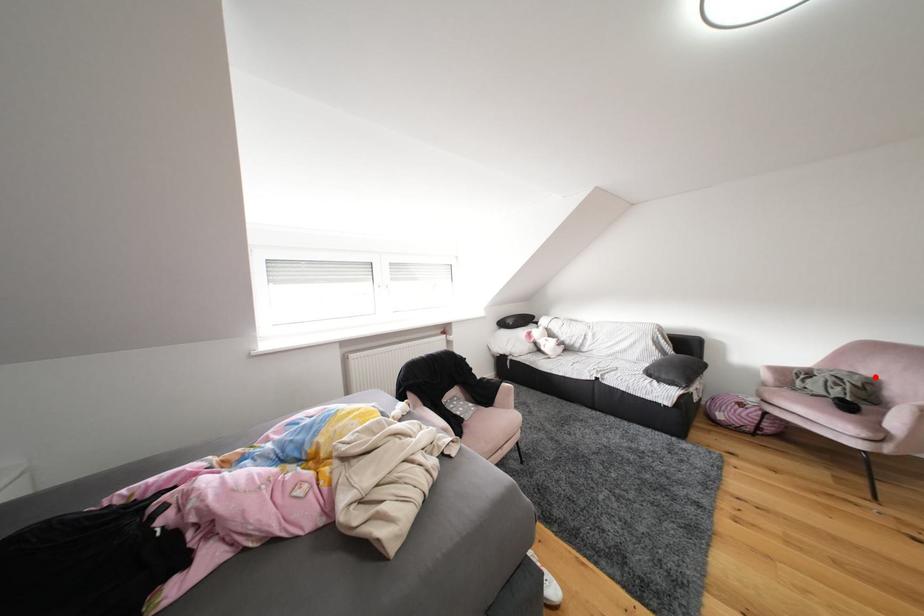
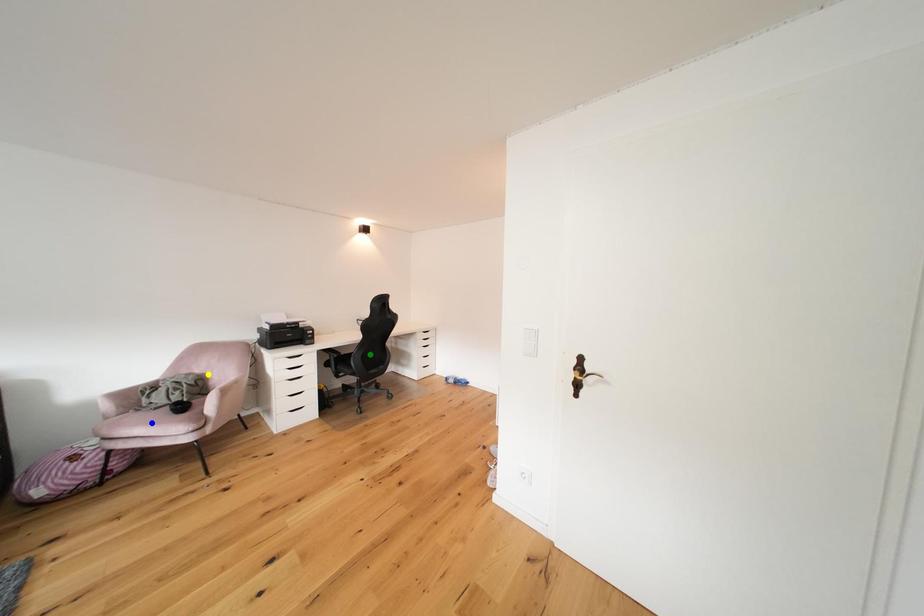
Question: I am providing you with two images of the same scene from different viewpoints. A red point is marked on the first image. You are given multiple points on the second image. Which point in image 2 is actually the same real-world point as the red point in image 1?

Choices:
 (A) blue point
 (B) yellow point
 (C) green point

Answer: (B)